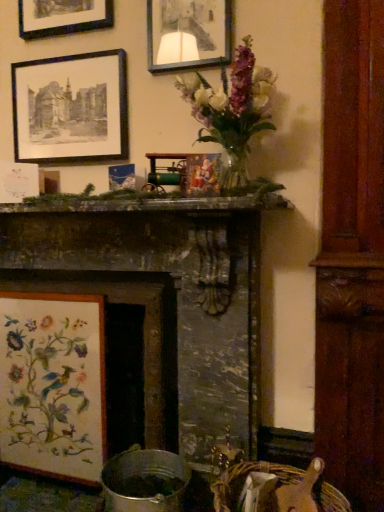
Question: Is black paper picture frame at upper left, acting as the 2th picture frame starting from the bottom, looking in the opposite direction of woven straw basket at lower right?

Choices:
 (A) no
 (B) yes

Answer: (A)

Question: Are black paper picture frame at upper left, acting as the 2th picture frame starting from the bottom, and woven straw basket at lower right far apart?

Choices:
 (A) no
 (B) yes

Answer: (B)

Question: From the image's perspective, is black paper picture frame at upper left, which is the 2th picture frame in top-to-bottom order, located above woven straw basket at lower right?

Choices:
 (A) yes
 (B) no

Answer: (A)

Question: Is the surface of black paper picture frame at upper left, which is the 2th picture frame in top-to-bottom order, in direct contact with woven straw basket at lower right?

Choices:
 (A) yes
 (B) no

Answer: (B)

Question: Does black paper picture frame at upper left, acting as the 2th picture frame starting from the bottom, have a greater height compared to woven straw basket at lower right?

Choices:
 (A) yes
 (B) no

Answer: (A)

Question: From a real-world perspective, is wooden floral embroidery at lower left, which appears as the 3th picture frame when viewed from the top, positioned above or below dark gray stone fireplace at center?

Choices:
 (A) above
 (B) below

Answer: (B)

Question: Is wooden floral embroidery at lower left, the first picture frame from the bottom, wider or thinner than dark gray stone fireplace at center?

Choices:
 (A) wide
 (B) thin

Answer: (B)

Question: From the image's perspective, relative to dark gray stone fireplace at center, is wooden floral embroidery at lower left, which appears as the 3th picture frame when viewed from the top, above or below?

Choices:
 (A) above
 (B) below

Answer: (B)

Question: In terms of size, does wooden floral embroidery at lower left, which appears as the 3th picture frame when viewed from the top, appear bigger or smaller than dark gray stone fireplace at center?

Choices:
 (A) big
 (B) small

Answer: (B)

Question: Is woven straw basket at lower right in front of or behind black paper picture frame at upper left, which is the 2th picture frame in top-to-bottom order, in the image?

Choices:
 (A) front
 (B) behind

Answer: (A)

Question: Based on their sizes in the image, would you say woven straw basket at lower right is bigger or smaller than black paper picture frame at upper left, which is the 2th picture frame in top-to-bottom order?

Choices:
 (A) small
 (B) big

Answer: (B)

Question: From the image's perspective, is woven straw basket at lower right positioned above or below black paper picture frame at upper left, acting as the 2th picture frame starting from the bottom?

Choices:
 (A) below
 (B) above

Answer: (A)

Question: Which is correct: woven straw basket at lower right is inside black paper picture frame at upper left, acting as the 2th picture frame starting from the bottom, or outside of it?

Choices:
 (A) outside
 (B) inside

Answer: (A)

Question: Considering the positions of woven straw basket at lower right and wooden floral embroidery at lower left, the first picture frame from the bottom, in the image, is woven straw basket at lower right bigger or smaller than wooden floral embroidery at lower left, the first picture frame from the bottom,?

Choices:
 (A) big
 (B) small

Answer: (B)

Question: In terms of height, does woven straw basket at lower right look taller or shorter compared to wooden floral embroidery at lower left, which appears as the 3th picture frame when viewed from the top?

Choices:
 (A) tall
 (B) short

Answer: (B)